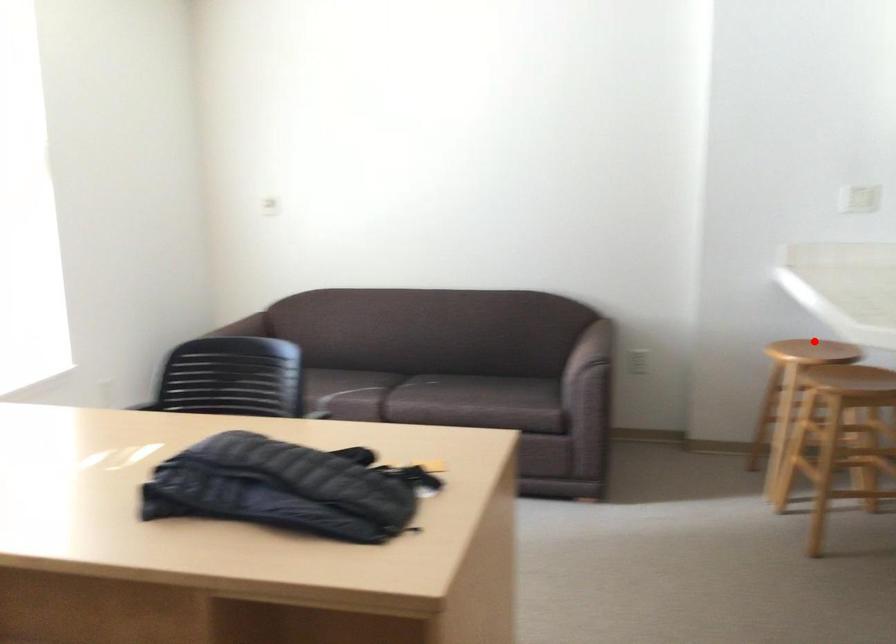
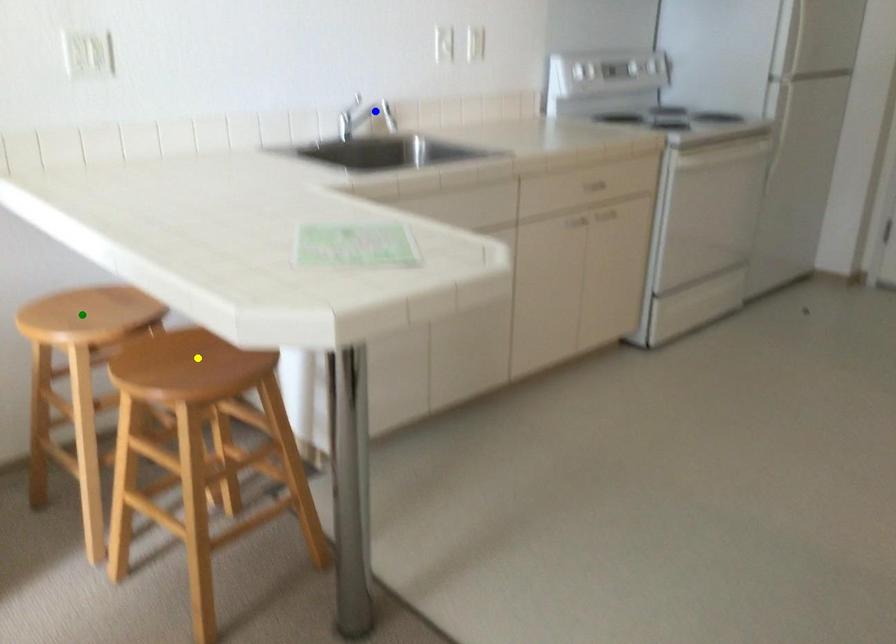
Question: I am providing you with two images of the same scene from different viewpoints. A red point is marked on the first image. You are given multiple points on the second image. Which spot in image 2 lines up with the point in image 1?

Choices:
 (A) blue point
 (B) yellow point
 (C) green point

Answer: (C)